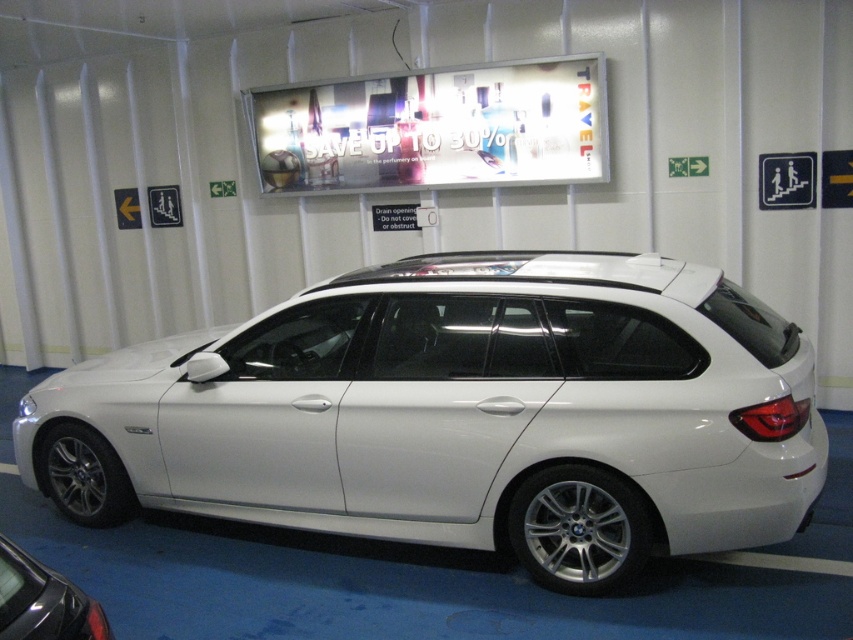
Between point (471, 396) and point (62, 611), which one is positioned behind?

The point (471, 396) is behind.

Which of these two, white metallic car at center or white metallic car at lower left, stands shorter?

With less height is white metallic car at lower left.

Between point (740, 520) and point (9, 609), which one is positioned behind?

Positioned behind is point (740, 520).

Locate an element on the screen. white metallic car at center is located at coordinates (460, 413).